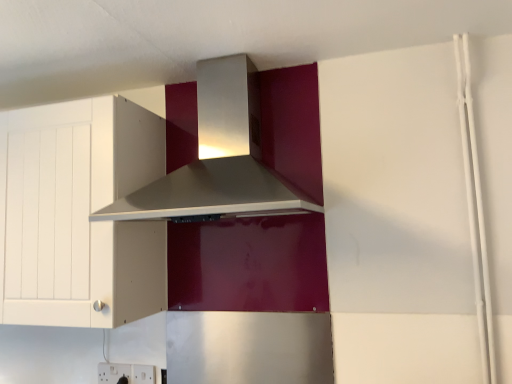
Question: Considering the relative positions of white plastic electric outlet at lower left, marked as the 1th electric outlet in a left-to-right arrangement, and satin silver range hood at upper center in the image provided, is white plastic electric outlet at lower left, marked as the 1th electric outlet in a left-to-right arrangement, to the left of satin silver range hood at upper center from the viewer's perspective?

Choices:
 (A) no
 (B) yes

Answer: (B)

Question: From the image's perspective, is white plastic electric outlet at lower left, marked as the 1th electric outlet in a left-to-right arrangement, beneath satin silver range hood at upper center?

Choices:
 (A) no
 (B) yes

Answer: (B)

Question: Is satin silver range hood at upper center inside white plastic electric outlet at lower left, the second electric outlet viewed from the right?

Choices:
 (A) no
 (B) yes

Answer: (A)

Question: Can you confirm if white plastic electric outlet at lower left, the second electric outlet viewed from the right, is positioned to the right of satin silver range hood at upper center?

Choices:
 (A) no
 (B) yes

Answer: (A)

Question: Is the depth of white plastic electric outlet at lower left, the second electric outlet viewed from the right, greater than that of satin silver range hood at upper center?

Choices:
 (A) no
 (B) yes

Answer: (B)

Question: Is white plastic electric outlet at lower left, marked as the 1th electric outlet in a left-to-right arrangement, to the left or to the right of satin silver range hood at upper center in the image?

Choices:
 (A) left
 (B) right

Answer: (A)

Question: Considering their positions, is white plastic electric outlet at lower left, marked as the 1th electric outlet in a left-to-right arrangement, located in front of or behind satin silver range hood at upper center?

Choices:
 (A) front
 (B) behind

Answer: (B)

Question: Does point (97, 370) appear closer or farther from the camera than point (238, 168)?

Choices:
 (A) closer
 (B) farther

Answer: (B)

Question: From the image's perspective, is white plastic electric outlet at lower left, the second electric outlet viewed from the right, above or below satin silver range hood at upper center?

Choices:
 (A) above
 (B) below

Answer: (B)

Question: Looking at their shapes, would you say white plastic electric outlet at lower center, the second electric outlet from the left, is wider or thinner than satin silver range hood at upper center?

Choices:
 (A) thin
 (B) wide

Answer: (A)

Question: From the image's perspective, relative to satin silver range hood at upper center, is white plastic electric outlet at lower center, the second electric outlet from the left, above or below?

Choices:
 (A) above
 (B) below

Answer: (B)

Question: Is white plastic electric outlet at lower center, placed as the 1th electric outlet when sorted from right to left, bigger or smaller than satin silver range hood at upper center?

Choices:
 (A) big
 (B) small

Answer: (B)

Question: Is point (151, 379) positioned closer to the camera than point (270, 173)?

Choices:
 (A) farther
 (B) closer

Answer: (A)

Question: From a real-world perspective, is satin silver range hood at upper center positioned above or below white matte cabinet at left?

Choices:
 (A) below
 (B) above

Answer: (B)

Question: Visually, is satin silver range hood at upper center positioned to the left or to the right of white matte cabinet at left?

Choices:
 (A) right
 (B) left

Answer: (A)